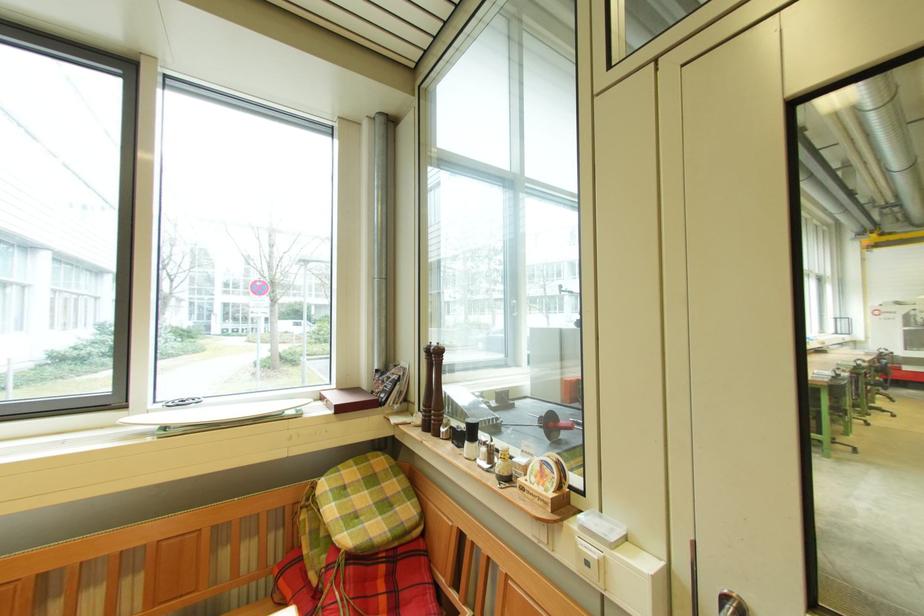
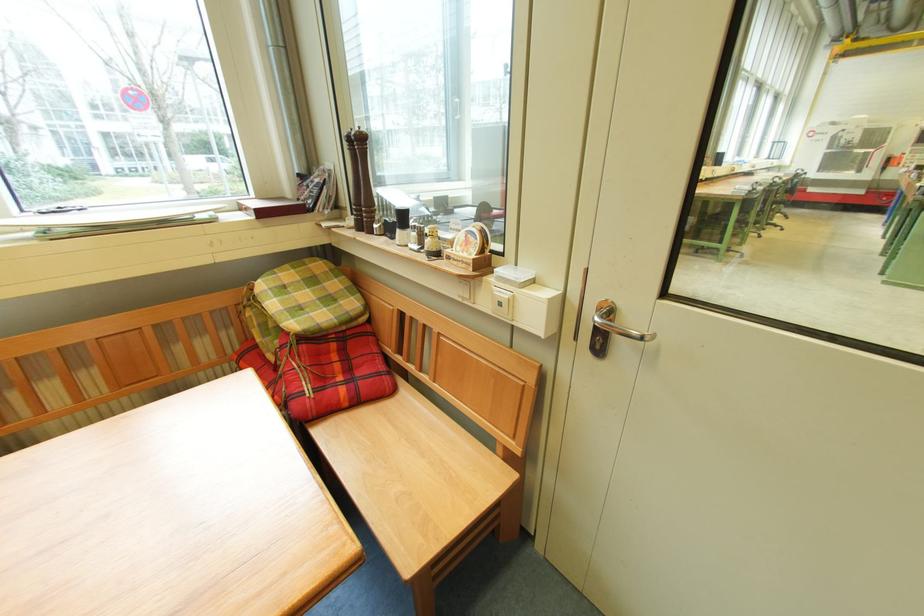
Where in the second image is the point corresponding to point 466,431 from the first image?

(397, 224)